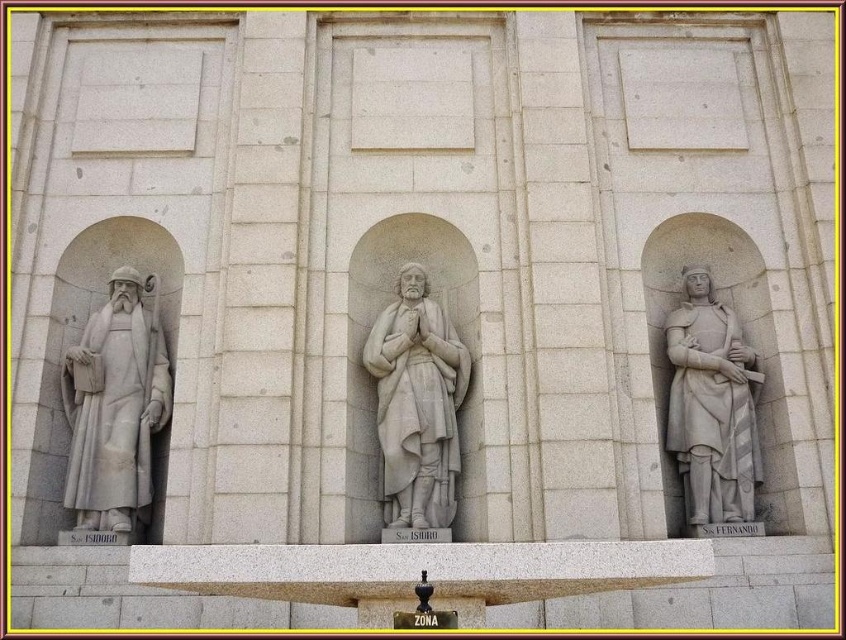
Is white marble statue at left taller than white stone statue at right?

In fact, white marble statue at left may be shorter than white stone statue at right.

Is white marble statue at left further to camera compared to white stone statue at right?

No, white marble statue at left is closer to the viewer.

Between point (146, 332) and point (696, 420), which one is positioned behind?

Positioned behind is point (146, 332).

What are the coordinates of `white marble statue at left` in the screenshot? It's located at (114, 406).

Who is positioned more to the left, white marble statue at center or white stone statue at right?

Positioned to the left is white marble statue at center.

Looking at this image, is white marble statue at center wider than white stone statue at right?

In fact, white marble statue at center might be narrower than white stone statue at right.

Does point (419, 481) come behind point (726, 429)?

No, (419, 481) is closer to viewer.

You are a GUI agent. You are given a task and a screenshot of the screen. Output one action in this format:
    pyautogui.click(x=<x>, y=<y>)
    Task: Click on the white marble statue at center
    
    Given the screenshot: What is the action you would take?
    pyautogui.click(x=416, y=403)

Which is more to the right, white marble statue at left or white marble statue at center?

Positioned to the right is white marble statue at center.

Between white marble statue at left and white marble statue at center, which one has more height?

With more height is white marble statue at left.

I want to click on white marble statue at left, so click(114, 406).

This screenshot has height=640, width=846. Find the location of `white marble statue at left`. white marble statue at left is located at coordinates (114, 406).